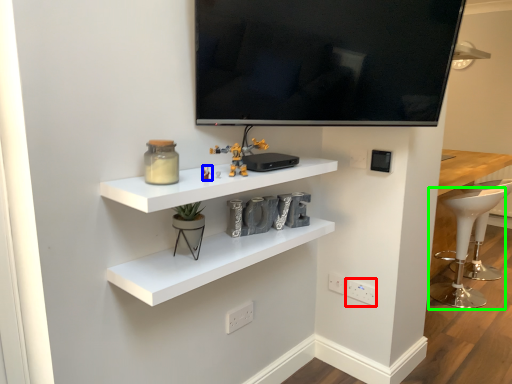
Question: Based on their relative distances, which object is nearer to electric outlet (highlighted by a red box)? Choose from toy (highlighted by a blue box) and bar stool (highlighted by a green box).

Choices:
 (A) toy
 (B) bar stool

Answer: (A)